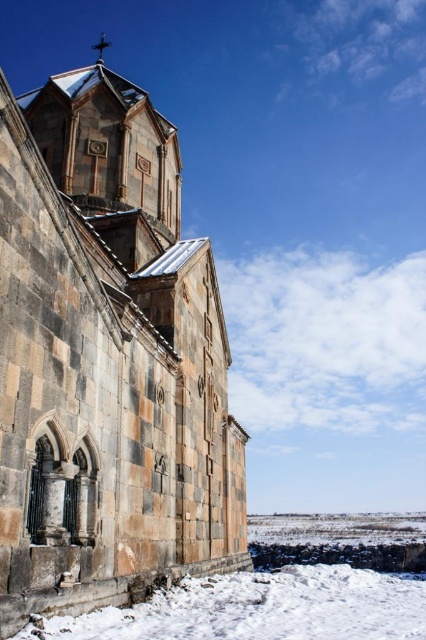
You are standing at the entrance of the historic stone church and see two points marked on the ground. One is labeled as point (226, 548) and the other as point (152, 602). Which point is closer to the bell tower located at the rear of the church?

Point (226, 548) is behind point (152, 602), so it is closer to the bell tower at the rear of the church.

You are a photographer planning to capture the rustic stone church at center and the white powdery snow at lower center in a single frame. Based on their sizes, which object would appear larger in the photo?

The rustic stone church at center would appear larger in the photo because its width surpasses that of the white powdery snow at lower center.